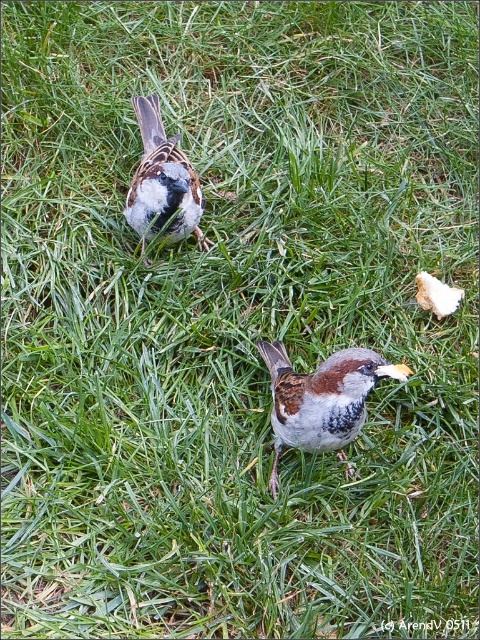
Based on the photo, does brown speckled sparrow at center have a greater height compared to brown speckled sparrow at upper center?

No.

Does brown speckled sparrow at center appear on the left side of brown speckled sparrow at upper center?

In fact, brown speckled sparrow at center is to the right of brown speckled sparrow at upper center.

Find the location of a particular element. This screenshot has width=480, height=640. brown speckled sparrow at center is located at coordinates (322, 397).

The width and height of the screenshot is (480, 640). Identify the location of brown speckled sparrow at center. (322, 397).